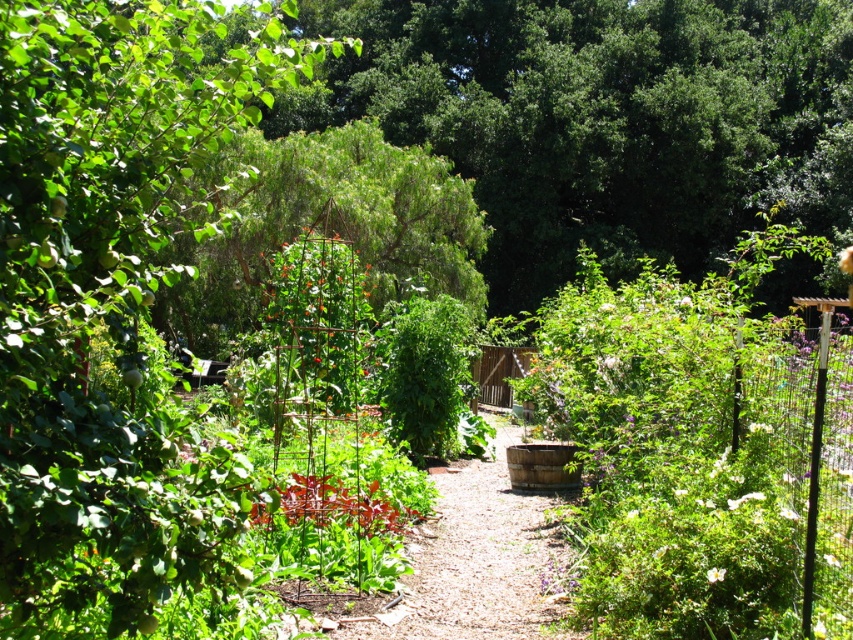
Between point (94, 592) and point (450, 180), which one is positioned behind?

Point (450, 180)

Which is in front, point (218, 97) or point (296, 179)?

Point (218, 97)

Where is `green leafy tree at upper left`? This screenshot has height=640, width=853. green leafy tree at upper left is located at coordinates (111, 294).

Locate an element on the screen. green leafy tree at upper left is located at coordinates (111, 294).

I want to click on green leafy tree at upper left, so click(x=111, y=294).

Which is behind, point (122, 150) or point (494, 616)?

Positioned behind is point (494, 616).

The height and width of the screenshot is (640, 853). Identify the location of green leafy tree at upper left. (111, 294).

Is green leafy tree at center smaller than dirt path at center?

No, green leafy tree at center is not smaller than dirt path at center.

This screenshot has height=640, width=853. Find the location of `green leafy tree at center`. green leafy tree at center is located at coordinates tap(326, 227).

Is point (270, 172) farther from viewer compared to point (547, 564)?

Yes, point (270, 172) is farther from viewer.

You are a GUI agent. You are given a task and a screenshot of the screen. Output one action in this format:
    pyautogui.click(x=<x>, y=<y>)
    Task: Click on the green leafy tree at center
    Image resolution: width=853 pixels, height=640 pixels.
    Given the screenshot: What is the action you would take?
    pyautogui.click(x=326, y=227)